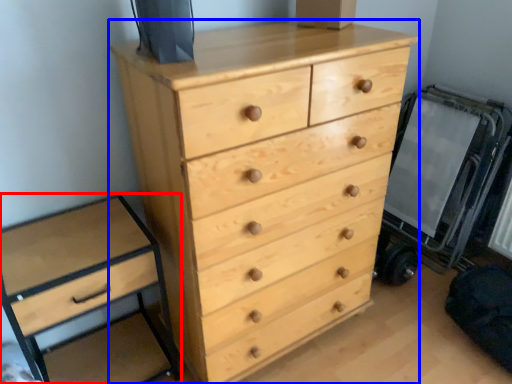
Question: Which of the following is the farthest to the observer, chest of drawers (highlighted by a red box) or chest of drawers (highlighted by a blue box)?

Choices:
 (A) chest of drawers
 (B) chest of drawers

Answer: (A)